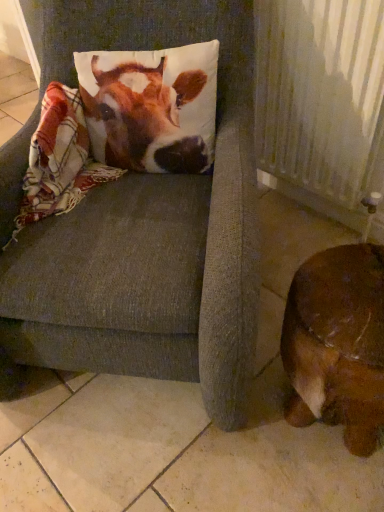
The height and width of the screenshot is (512, 384). What do you see at coordinates (143, 117) in the screenshot?
I see `printed fabric pillow at upper left` at bounding box center [143, 117].

Where is `brown leather dog at lower right`? Image resolution: width=384 pixels, height=512 pixels. brown leather dog at lower right is located at coordinates (337, 343).

Is printed fabric pillow at upper left located within brown leather dog at lower right?

Actually, printed fabric pillow at upper left is outside brown leather dog at lower right.

Is there a large distance between brown leather dog at lower right and printed fabric pillow at upper left?

Actually, brown leather dog at lower right and printed fabric pillow at upper left are a little close together.

From a real-world perspective, is brown leather dog at lower right on printed fabric pillow at upper left?

Actually, brown leather dog at lower right is physically below printed fabric pillow at upper left in the real world.

In the scene shown: Considering the sizes of objects brown leather dog at lower right and printed fabric pillow at upper left in the image provided, who is smaller, brown leather dog at lower right or printed fabric pillow at upper left?

With smaller size is printed fabric pillow at upper left.

Are brown leather dog at lower right and white textured radiator at right far apart?

They are positioned close to each other.

Between brown leather dog at lower right and white textured radiator at right, which one has more height?

white textured radiator at right.

Considering the sizes of brown leather dog at lower right and white textured radiator at right in the image, is brown leather dog at lower right wider or thinner than white textured radiator at right?

Clearly, brown leather dog at lower right has more width compared to white textured radiator at right.

Image resolution: width=384 pixels, height=512 pixels. Find the location of `radiator behind the printed fabric pillow at upper left`. radiator behind the printed fabric pillow at upper left is located at coordinates (322, 104).

From the picture: Is printed fabric pillow at upper left directly adjacent to white textured radiator at right?

printed fabric pillow at upper left is not next to white textured radiator at right, and they're not touching.

In terms of height, does printed fabric pillow at upper left look taller or shorter compared to white textured radiator at right?

In the image, printed fabric pillow at upper left appears to be shorter than white textured radiator at right.

Is point (159, 122) closer to viewer compared to point (256, 106)?

Yes, point (159, 122) is in front of point (256, 106).

Which is more to the left, brown leather dog at lower right or textured gray cushion at center?

From the viewer's perspective, textured gray cushion at center appears more on the left side.

In the scene shown: Is brown leather dog at lower right placed right next to textured gray cushion at center?

They are not placed beside each other.

Which object is further away from the camera, brown leather dog at lower right or textured gray cushion at center?

brown leather dog at lower right is further from the camera.

Looking at this image, from a real-world perspective, is printed fabric pillow at upper left positioned above or below textured gray cushion at center?

From a real-world perspective, printed fabric pillow at upper left is physically above textured gray cushion at center.

Is printed fabric pillow at upper left far from textured gray cushion at center?

They are positioned close to each other.

Can you confirm if printed fabric pillow at upper left is smaller than textured gray cushion at center?

Yes.

Considering the relative positions of printed fabric pillow at upper left and textured gray cushion at center in the image provided, is printed fabric pillow at upper left to the left of textured gray cushion at center from the viewer's perspective?

No, printed fabric pillow at upper left is not to the left of textured gray cushion at center.

From a real-world perspective, is white textured radiator at right positioned over printed fabric pillow at upper left based on gravity?

No, from a real-world perspective, white textured radiator at right is not on top of printed fabric pillow at upper left.

Could printed fabric pillow at upper left be considered to be inside white textured radiator at right?

Actually, printed fabric pillow at upper left is outside white textured radiator at right.

In order to click on cattle below the white textured radiator at right (from the image's perspective) in this screenshot , I will do `click(143, 117)`.

Relative to brown leather dog at lower right, is white textured radiator at right in front or behind?

white textured radiator at right is positioned farther from the viewer than brown leather dog at lower right.

Can you confirm if white textured radiator at right is positioned to the right of brown leather dog at lower right?

Yes, white textured radiator at right is to the right of brown leather dog at lower right.

Considering the relative sizes of white textured radiator at right and brown leather dog at lower right in the image provided, is white textured radiator at right wider than brown leather dog at lower right?

No, white textured radiator at right is not wider than brown leather dog at lower right.

This screenshot has width=384, height=512. Find the location of `dog that appears on the right of printed fabric pillow at upper left`. dog that appears on the right of printed fabric pillow at upper left is located at coordinates (337, 343).

The image size is (384, 512). I want to click on radiator positioned vertically above the brown leather dog at lower right (from a real-world perspective), so click(322, 104).

Looking at the image, which one is located further to textured gray cushion at center, brown leather dog at lower right or white textured radiator at right?

white textured radiator at right lies further to textured gray cushion at center than the other object.

Based on their spatial positions, is brown leather dog at lower right or printed fabric pillow at upper left closer to white textured radiator at right?

printed fabric pillow at upper left lies closer to white textured radiator at right than the other object.

When comparing their distances from printed fabric pillow at upper left, does brown leather dog at lower right or textured gray cushion at center seem closer?

textured gray cushion at center lies closer to printed fabric pillow at upper left than the other object.

Which object lies further to the anchor point printed fabric pillow at upper left, brown leather dog at lower right or white textured radiator at right?

brown leather dog at lower right.

Considering their positions, is textured gray cushion at center positioned closer to printed fabric pillow at upper left than white textured radiator at right?

textured gray cushion at center lies closer to printed fabric pillow at upper left than the other object.

Looking at the image, which one is located further to textured gray cushion at center, brown leather dog at lower right or printed fabric pillow at upper left?

The object further to textured gray cushion at center is brown leather dog at lower right.

Estimate the real-world distances between objects in this image. Which object is closer to white textured radiator at right, brown leather dog at lower right or textured gray cushion at center?

The object closer to white textured radiator at right is textured gray cushion at center.

In the scene shown: Estimate the real-world distances between objects in this image. Which object is closer to brown leather dog at lower right, white textured radiator at right or printed fabric pillow at upper left?

Among the two, white textured radiator at right is located nearer to brown leather dog at lower right.

What are the coordinates of `chair between white textured radiator at right and brown leather dog at lower right in the vertical direction` in the screenshot? It's located at (150, 229).

Find the location of a particular element. This screenshot has width=384, height=512. cattle between textured gray cushion at center and white textured radiator at right is located at coordinates (143, 117).

Find the location of `cattle between white textured radiator at right and brown leather dog at lower right in the up-down direction`. cattle between white textured radiator at right and brown leather dog at lower right in the up-down direction is located at coordinates (143, 117).

This screenshot has width=384, height=512. In order to click on chair between printed fabric pillow at upper left and brown leather dog at lower right vertically in this screenshot , I will do `click(150, 229)`.